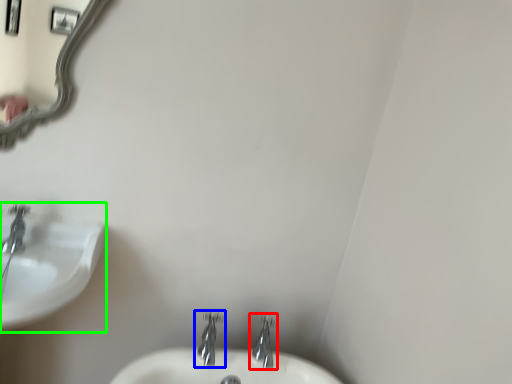
Question: Which object is the closest to the tap (highlighted by a red box)? Choose among these: tap (highlighted by a blue box) or sink (highlighted by a green box).

Choices:
 (A) tap
 (B) sink

Answer: (A)